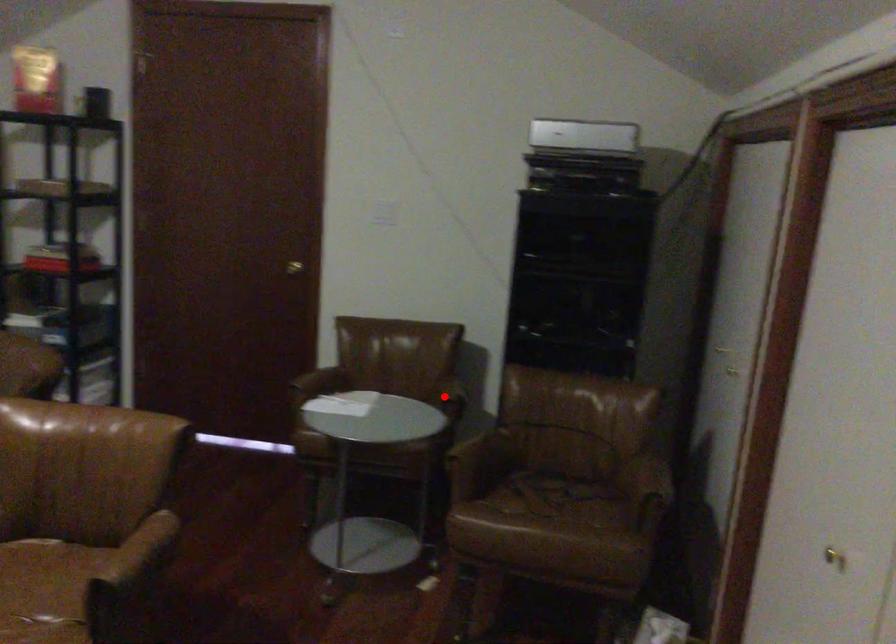
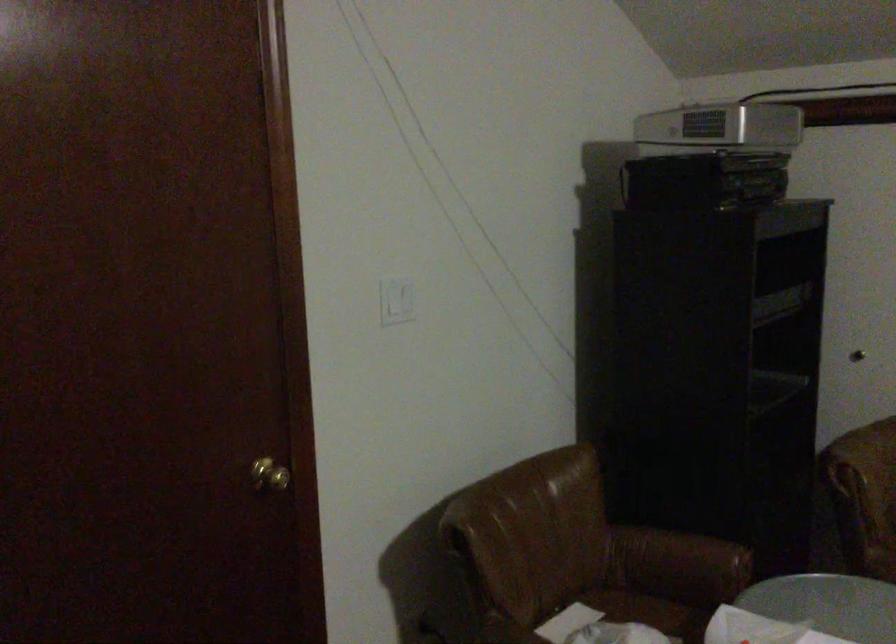
Question: I am providing you with two images of the same scene from different viewpoints. Image1 has a red point marked. In image2, the corresponding 3D location appears at what relative position? Reply with the corresponding letter.

Choices:
 (A) Closer
 (B) Farther

Answer: (A)